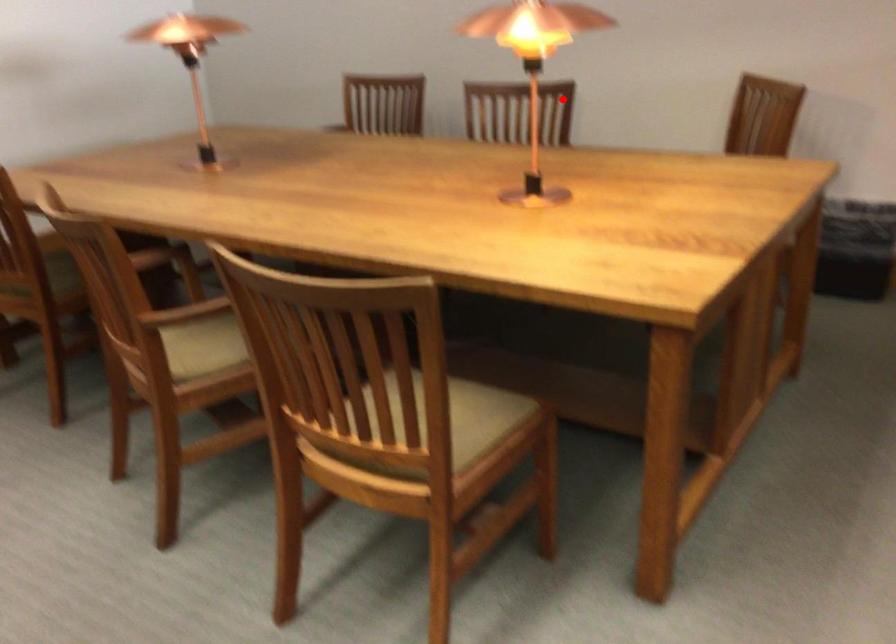
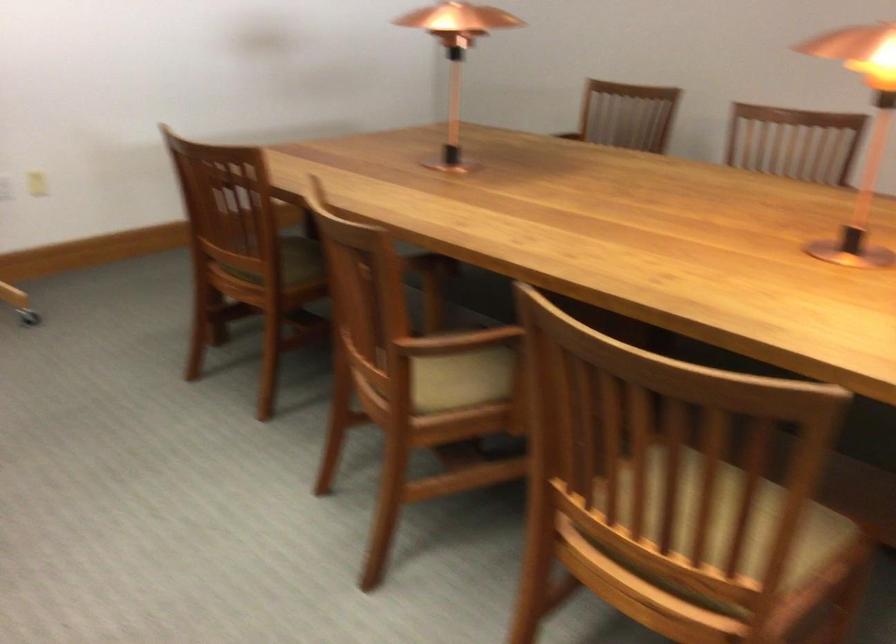
Question: I am providing you with two images of the same scene from different viewpoints. In image1, a red point is highlighted. Considering the same 3D point in image2, which of the following is correct?

Choices:
 (A) It is closer
 (B) It is farther

Answer: (A)